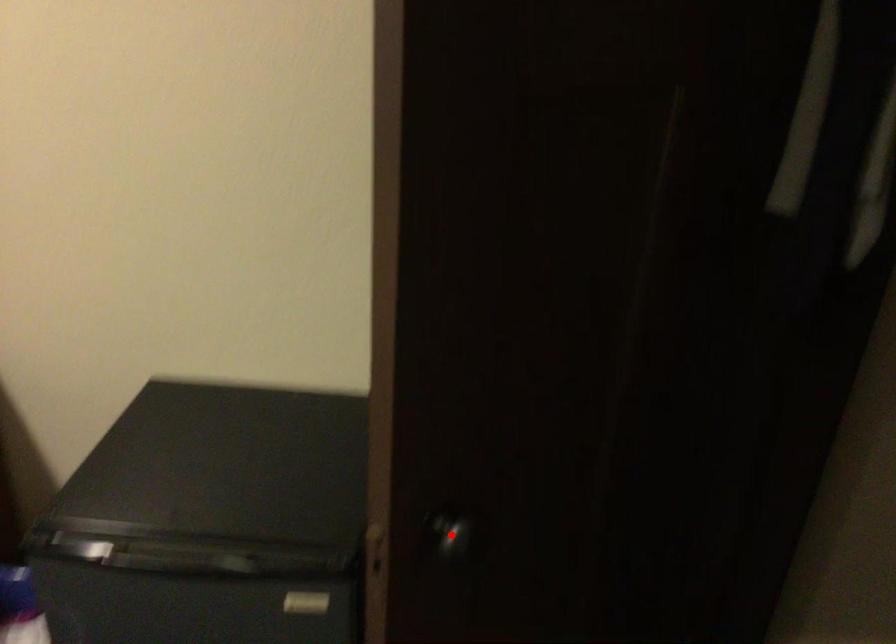
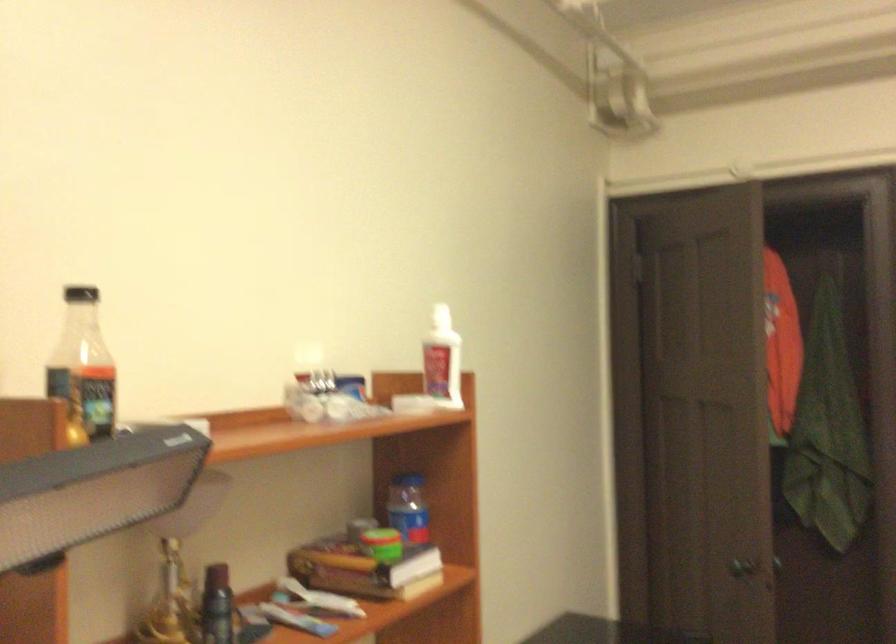
Question: I am providing you with two images of the same scene from different viewpoints. A red point is marked on the first image. At the location where the point appears in image 1, is it still visible in image 2?

Choices:
 (A) Yes
 (B) No

Answer: (B)